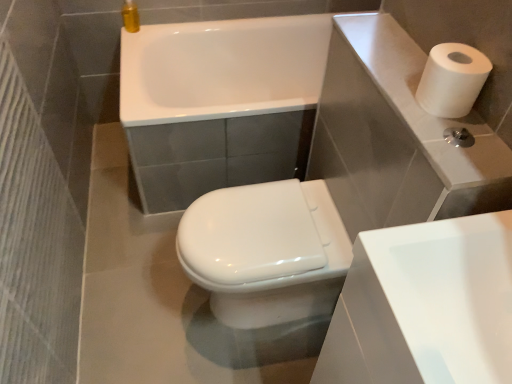
I want to click on free point above white glossy sink at lower right (from a real-world perspective), so click(458, 293).